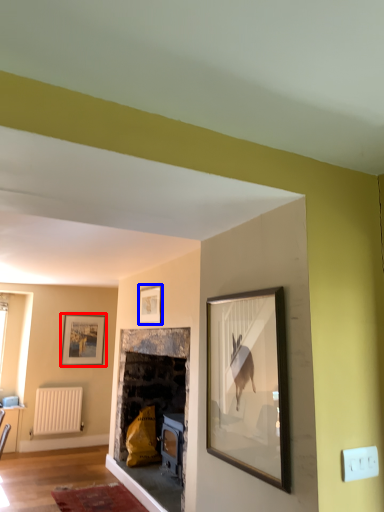
Question: Which object appears farthest to the camera in this image, picture frame (highlighted by a red box) or picture frame (highlighted by a blue box)?

Choices:
 (A) picture frame
 (B) picture frame

Answer: (A)